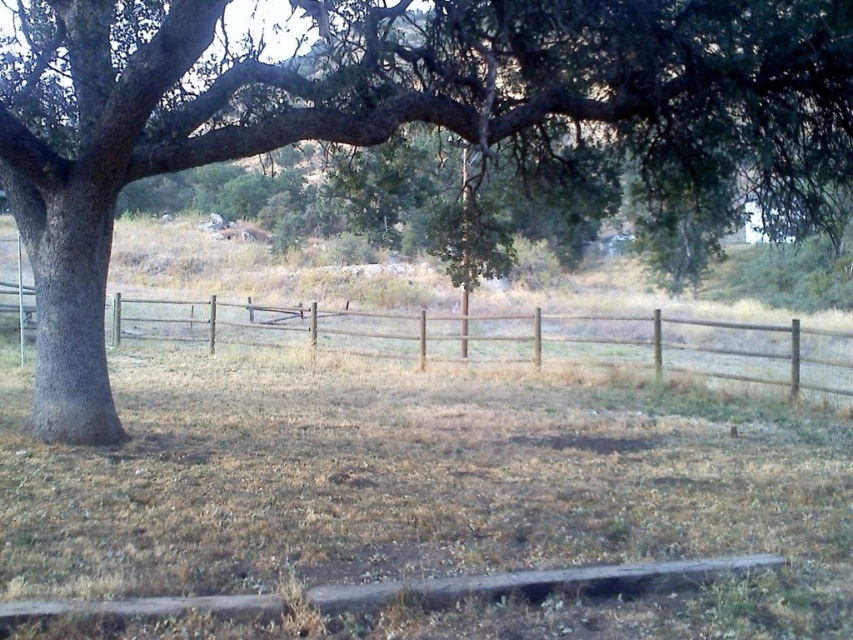
You are a painter standing 2 meters away from the green rough bark tree at left. You want to paint the brown wooden fence at center. Can you reach the fence with your 4 meter long paintbrush without moving closer?

The distance between the green rough bark tree at left and the brown wooden fence at center is 3.77 meters. Since you are already 2 meters away from the tree, the total distance to the fence would be 2 meters plus 3.77 meters, totaling 5.77 meters. Your paintbrush is only 4 meters long, so you cannot reach the fence without moving closer.

You are standing at the point marked by the coordinates (425, 497) in the image. What is the name of the object directly beneath your feet?

Result: The dry grass at center is located at point (425, 497), so the object directly beneath your feet is the dry grass at center.

You are a gardener who wants to plant flowers between the dry grass at center and the brown wooden fence at center. The flowers require a minimum of 10 feet of space to grow properly. Based on the scene, will there be enough space for the flowers to grow between these two objects?

The dry grass at center and brown wooden fence at center are 12.12 feet apart from each other, which is more than the required 10 feet of space. Therefore, there is enough space for the flowers to grow between these two objects.